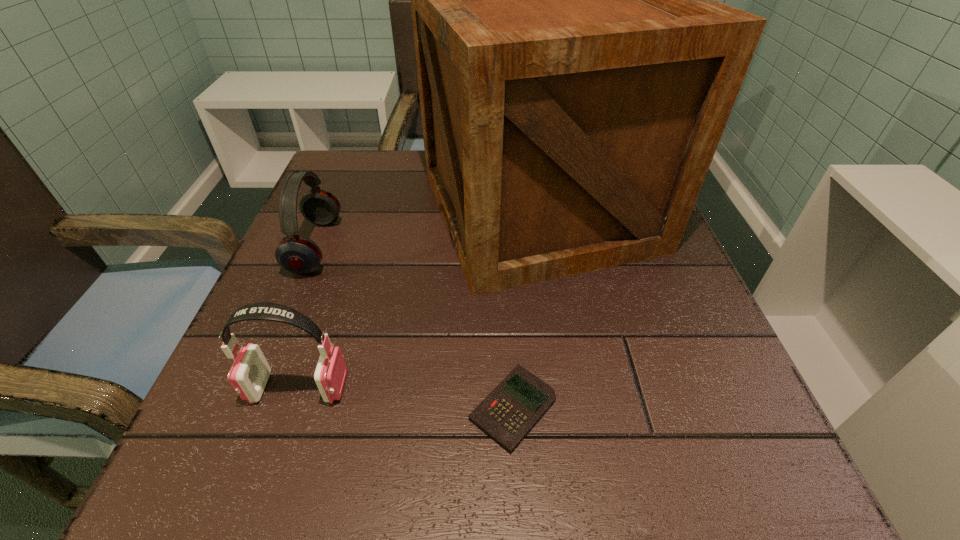
At what (x,y) coordinates should I click in order to perform the action: click on vacant space that satisfies the following two spatial constraints: 1. on the outer surface of the calculator; 2. on the right side of the nearer earphone. Please return your answer as a coordinate pair (x, y). The width and height of the screenshot is (960, 540). Looking at the image, I should click on (291, 408).

This screenshot has width=960, height=540. I want to click on vacant position in the image that satisfies the following two spatial constraints: 1. on the ear cups of the farther earphone; 2. on the back side of the shortest object, so click(249, 408).

I want to click on vacant space that satisfies the following two spatial constraints: 1. on the front side of the tallest object; 2. on the ear cups of the farther earphone, so click(544, 247).

Locate an element on the screen. The width and height of the screenshot is (960, 540). vacant space that satisfies the following two spatial constraints: 1. on the back side of the shortest object; 2. on the outer surface of the nearer earphone is located at coordinates (511, 387).